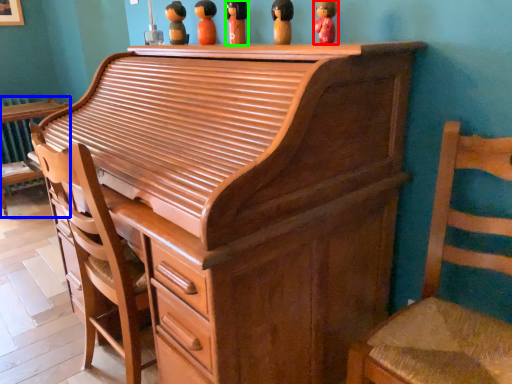
Question: Based on their relative distances, which object is farther from toy (highlighted by a red box)? Choose from furniture (highlighted by a blue box) and toy (highlighted by a green box).

Choices:
 (A) furniture
 (B) toy

Answer: (A)